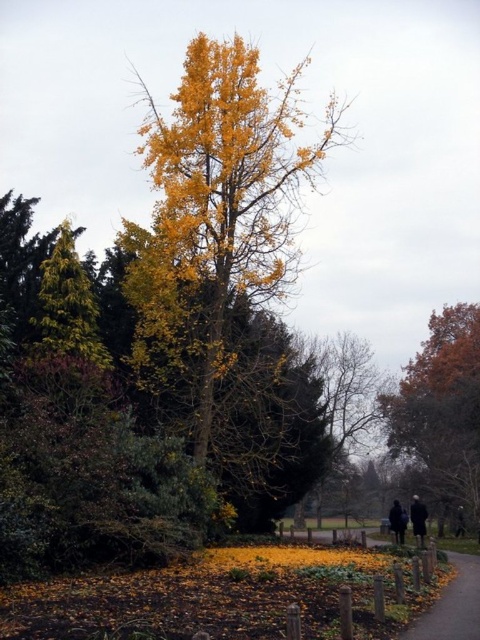
You are a photographer planning to capture a closeup of the autumn tree. You have two jackets, the dark blue fabric jacket at lower right and the dark gray jacket at lower right, placed near the base of the tree. Which jacket should you move to ensure the tree remains the central focus in your photo?

The dark blue fabric jacket at lower right has a smaller width than the dark gray jacket at lower right. To keep the tree as the central focus, move the darker gray jacket since it is wider and more likely to distract from the tree.

You are a photographer setting up a tripod in the lower right corner of the scene. You want to capture both the orange matte tree at lower right and the dark blue fabric jacket at lower right in your shot. However, you need to adjust your camera angle to ensure both are fully visible. Which object will require you to zoom out more to include it in the frame?

The orange matte tree at lower right is bigger than the dark blue fabric jacket at lower right, so you will need to zoom out more to include the orange matte tree at lower right in the frame.

You are standing at the center of the image and want to walk towards the orange matte tree at lower right. Which direction should you face to walk directly towards it?

Since the orange matte tree at lower right is located at point 0.639 on the x axis and 0.921 on the y axis, you should face towards the lower right direction to walk directly towards it.